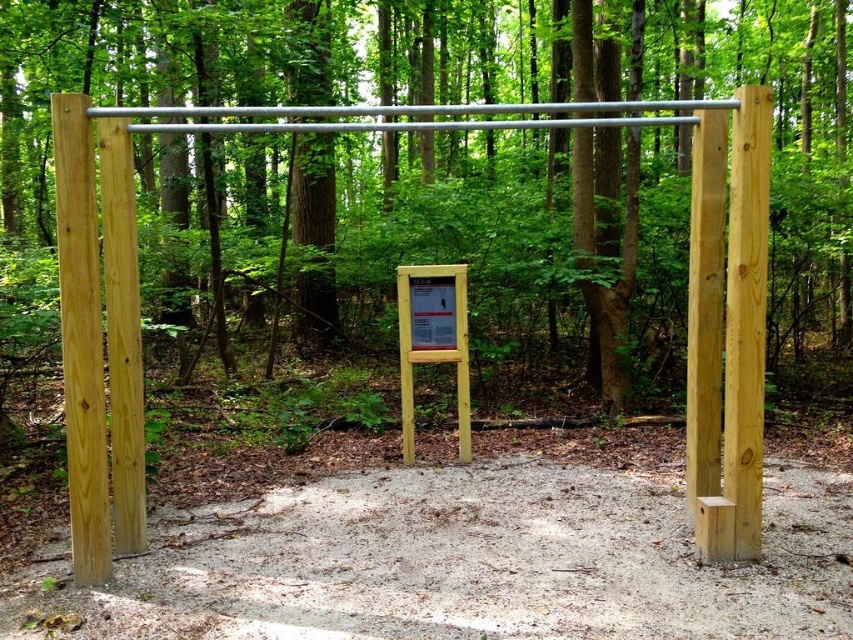
You are a park visitor who wants to read the instructions on the natural wood sign at center. Which direction should you walk from the natural light wood post at left to reach the sign?

You should walk to the right of the natural light wood post at left to reach the natural wood sign at center, as the natural wood sign at center is located to the right of the natural light wood post at left.

You are standing at the fitness station and want to reach both points mentioned. Which point is closer to you, point (x=213, y=100) or point (x=73, y=177)?

Point (x=73, y=177) is closer to you because it is less further to the viewer than point (x=213, y=100).

You are planning to hang a small birdhouse between the natural light wood post at left and the wooden sign at center. Which object should the birdhouse be closer to if you want it to be under the taller structure?

The birdhouse should be closer to the natural light wood post at left because it is taller than the wooden sign at center, so placing it there would ensure it is under the taller structure.